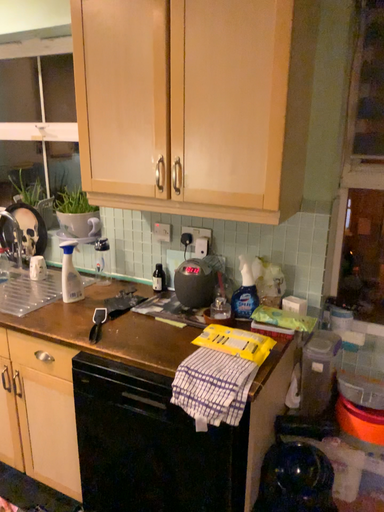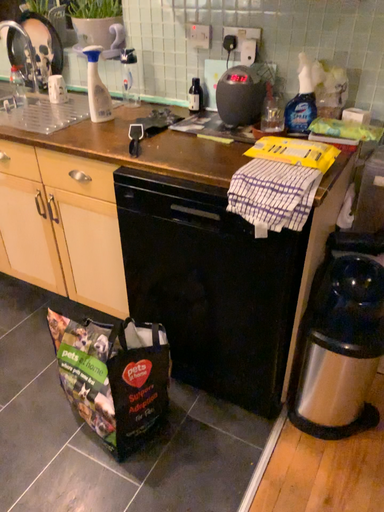
Question: How did the camera likely rotate when shooting the video?

Choices:
 (A) rotated upward
 (B) rotated downward

Answer: (B)